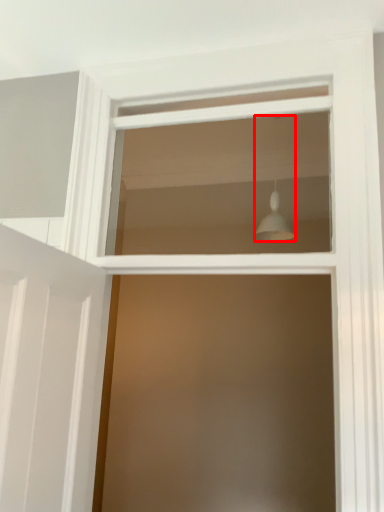
Question: From the image's perspective, considering the relative positions of light fixture (annotated by the red box) and window in the image provided, where is light fixture (annotated by the red box) located with respect to the staircase?

Choices:
 (A) above
 (B) below

Answer: (A)